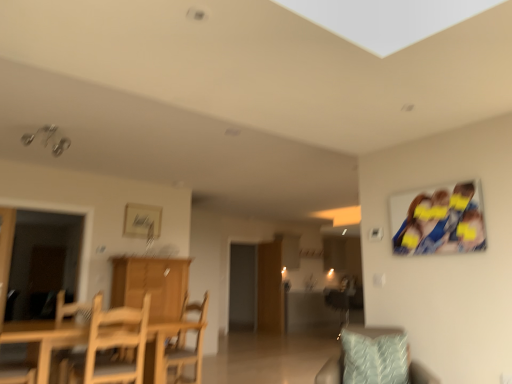
What do you see at coordinates (17, 373) in the screenshot?
I see `wooden chair at lower left, the 4th chair viewed from the right` at bounding box center [17, 373].

What is the approximate height of light blue textured pillow at lower right?

The height of light blue textured pillow at lower right is 18.25 inches.

What is the approximate height of blue fabric photo at upper right?

19.81 inches.

What is the approximate width of blue fabric photo at upper right?

blue fabric photo at upper right is 2.51 inches wide.

Describe the element at coordinates (45, 338) in the screenshot. This screenshot has width=512, height=384. I see `light wood table at lower left` at that location.

At what (x,y) coordinates should I click in order to perform the action: click on transparent glass door at left, the first glass door in the left-to-right sequence. Please return your answer as a coordinate pair (x, y). Image resolution: width=512 pixels, height=384 pixels. Looking at the image, I should click on (42, 262).

Which is more to the right, light wood table at lower left or matte silver picture frame at upper center?

Positioned to the right is light wood table at lower left.

From the image's perspective, who appears lower, light wood table at lower left or matte silver picture frame at upper center?

From the image's view, light wood table at lower left is below.

Is light wood table at lower left not close to matte silver picture frame at upper center?

Yes, light wood table at lower left is far from matte silver picture frame at upper center.

Is light wood table at lower left facing towards matte silver picture frame at upper center?

No, light wood table at lower left does not turn towards matte silver picture frame at upper center.

Based on the photo, which is farther from the camera, (34, 302) or (327, 292)?

The point (327, 292) is behind.

In the image, is transparent glass door at left, the 2th glass door in the back-to-front sequence, on the left side or the right side of wooden chair at center, marked as the fourth chair in a left-to-right arrangement?

transparent glass door at left, the 2th glass door in the back-to-front sequence, is positioned on wooden chair at center, marked as the fourth chair in a left-to-right arrangement,'s left side.

Could you measure the distance between transparent glass door at left, the 2th glass door in the back-to-front sequence, and wooden chair at center, marked as the fourth chair in a left-to-right arrangement?

transparent glass door at left, the 2th glass door in the back-to-front sequence, and wooden chair at center, marked as the fourth chair in a left-to-right arrangement, are 5.46 meters apart from each other.

From the image's perspective, does transparent glass door at left, the first glass door in the left-to-right sequence, appear higher than wooden chair at center, which is counted as the 4th chair, starting from the front?

Correct, transparent glass door at left, the first glass door in the left-to-right sequence, appears higher than wooden chair at center, which is counted as the 4th chair, starting from the front, in the image.

Which of these two, light wood table at lower left or wooden chair at lower left, which ranks as the third chair in right-to-left order, is thinner?

Thinner between the two is wooden chair at lower left, which ranks as the third chair in right-to-left order.

From the image's perspective, which one is positioned higher, light wood table at lower left or wooden chair at lower left, which ranks as the third chair in right-to-left order?

wooden chair at lower left, which ranks as the third chair in right-to-left order, from the image's perspective.

Is wooden cabinet at center looking in the opposite direction of transparent glass door at center, positioned as the 1th glass door in back-to-front order?

No, wooden cabinet at center's orientation is not away from transparent glass door at center, positioned as the 1th glass door in back-to-front order.

Is wooden cabinet at center to the right of transparent glass door at center, the second glass door viewed from the left, from the viewer's perspective?

In fact, wooden cabinet at center is to the left of transparent glass door at center, the second glass door viewed from the left.

Is point (170, 278) farther from viewer compared to point (232, 271)?

No, it is not.

Based on the photo, does wooden cabinet at center have a larger size compared to transparent glass door at center, the second glass door viewed from the left?

Indeed, wooden cabinet at center has a larger size compared to transparent glass door at center, the second glass door viewed from the left.

Is wooden chair at center, marked as the 1th chair in a right-to-left arrangement, wider than wooden chair at center, which is the 3th chair in left-to-right order?

Yes.

Would you say wooden chair at center, marked as the 1th chair in a right-to-left arrangement, is to the left or to the right of wooden chair at center, placed as the 2th chair when sorted from back to front, in the picture?

Based on their positions, wooden chair at center, marked as the 1th chair in a right-to-left arrangement, is located to the right of wooden chair at center, placed as the 2th chair when sorted from back to front.

From a real-world perspective, starting from the wooden chair at center, marked as the 1th chair in a right-to-left arrangement, which chair is the 1st one vertically above it? Please provide its 2D coordinates.

[(187, 347)]

Measure the distance between wooden chair at center, which is counted as the 4th chair, starting from the front, and wooden chair at center, marked as the second chair in a right-to-left arrangement.

wooden chair at center, which is counted as the 4th chair, starting from the front, is 4.90 meters from wooden chair at center, marked as the second chair in a right-to-left arrangement.

Between light wood table at lower left and transparent glass door at center, the 1th glass door viewed from the right, which one has more height?

transparent glass door at center, the 1th glass door viewed from the right, is taller.

Which object is wider, light wood table at lower left or transparent glass door at center, the 1th glass door viewed from the right?

With larger width is light wood table at lower left.

Does light wood table at lower left turn towards transparent glass door at center, which is the second glass door from front to back?

No, light wood table at lower left is not turned towards transparent glass door at center, which is the second glass door from front to back.

Between light wood table at lower left and transparent glass door at center, positioned as the 1th glass door in back-to-front order, which one appears on the left side from the viewer's perspective?

light wood table at lower left is more to the left.

Is point (100, 317) positioned after point (61, 225)?

No, it is not.

From the image's perspective, is wooden chair at lower left, which ranks as the third chair in right-to-left order, located above or below transparent glass door at left, the 2th glass door in the back-to-front sequence?

wooden chair at lower left, which ranks as the third chair in right-to-left order, is situated lower than transparent glass door at left, the 2th glass door in the back-to-front sequence, in the image.

Considering the sizes of objects wooden chair at lower left, the 2th chair when ordered from front to back, and transparent glass door at left, which ranks as the second glass door in right-to-left order, in the image provided, who is wider, wooden chair at lower left, the 2th chair when ordered from front to back, or transparent glass door at left, which ranks as the second glass door in right-to-left order,?

With larger width is wooden chair at lower left, the 2th chair when ordered from front to back.

Is the depth of wooden chair at lower left, the 2th chair when ordered from front to back, greater than that of transparent glass door at left, the 2th glass door in the back-to-front sequence?

That is False.

Image resolution: width=512 pixels, height=384 pixels. Identify the location of table below the matte silver picture frame at upper center (from the image's perspective). (45, 338).

There is a wooden chair at center, marked as the 1th chair in a right-to-left arrangement. Identify the location of the 2nd glass door above it (from a real-world perspective). (42, 262).

Based on their spatial positions, is light blue textured pillow at lower right or wooden chair at center, the first chair positioned from the back, further from light wood table at lower left?

wooden chair at center, the first chair positioned from the back.

Considering their positions, is wooden chair at center, marked as the second chair in a right-to-left arrangement, positioned further to light wood table at lower left than blue fabric photo at upper right?

blue fabric photo at upper right is positioned further to the anchor light wood table at lower left.

In the scene shown: Considering their positions, is wooden cabinet at center positioned closer to light wood table at lower left than wooden chair at lower left, which appears as the 1th chair when viewed from the left?

wooden chair at lower left, which appears as the 1th chair when viewed from the left, lies closer to light wood table at lower left than the other object.

When comparing their distances from transparent glass door at center, which is the second glass door from front to back, does wooden cabinet at center or wooden chair at center, marked as the second chair in a right-to-left arrangement, seem closer?

wooden cabinet at center lies closer to transparent glass door at center, which is the second glass door from front to back, than the other object.

Looking at the image, which one is located further to wooden chair at center, which is the third chair in front-to-back order, wooden chair at lower left, which is counted as the 3th chair, starting from the back, or wooden chair at lower left?

Among the two, wooden chair at lower left is located further to wooden chair at center, which is the third chair in front-to-back order.

Based on their spatial positions, is wooden chair at center, marked as the second chair in a right-to-left arrangement, or wooden chair at lower left, the 1th chair positioned from the front, further from wooden chair at lower left, which ranks as the third chair in right-to-left order?

wooden chair at center, marked as the second chair in a right-to-left arrangement, is further to wooden chair at lower left, which ranks as the third chair in right-to-left order.

Based on their spatial positions, is wooden chair at lower left, the 2th chair when ordered from front to back, or transparent glass door at center, the second glass door viewed from the left, further from transparent glass door at left, which ranks as the second glass door in right-to-left order?

Based on the image, transparent glass door at center, the second glass door viewed from the left, appears to be further to transparent glass door at left, which ranks as the second glass door in right-to-left order.

Based on their spatial positions, is wooden chair at lower left, which is the second chair in left-to-right order, or matte silver picture frame at upper center closer to wooden chair at center, which is counted as the 4th chair, starting from the front?

matte silver picture frame at upper center is closer to wooden chair at center, which is counted as the 4th chair, starting from the front.

This screenshot has height=384, width=512. In order to click on glass door between wooden chair at lower left, which appears as the 1th chair when viewed from the left, and wooden chair at center, marked as the fourth chair in a left-to-right arrangement, from front to back in this screenshot , I will do `click(42, 262)`.

Image resolution: width=512 pixels, height=384 pixels. Find the location of `chair between transparent glass door at left, the first glass door in the left-to-right sequence, and transparent glass door at center, positioned as the 1th glass door in back-to-front order, along the z-axis`. chair between transparent glass door at left, the first glass door in the left-to-right sequence, and transparent glass door at center, positioned as the 1th glass door in back-to-front order, along the z-axis is located at coordinates (338, 304).

You are a GUI agent. You are given a task and a screenshot of the screen. Output one action in this format:
    pyautogui.click(x=<x>, y=<y>)
    Task: Click on the picture frame positioned between wooden chair at lower left, the 2th chair when ordered from front to back, and wooden chair at center, marked as the 1th chair in a right-to-left arrangement, from near to far
    The width and height of the screenshot is (512, 384).
    Given the screenshot: What is the action you would take?
    pyautogui.click(x=142, y=221)

Identify the location of table situated between wooden chair at lower left, which is the 4th chair from back to front, and wooden chair at lower left, the 2th chair when ordered from front to back, from left to right. (45, 338).